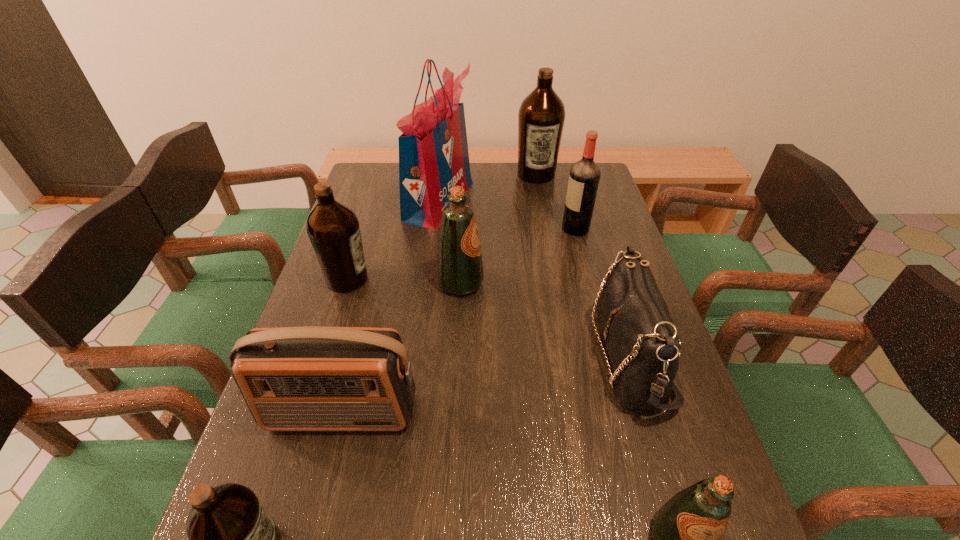
Find the location of a particular element. the tallest object is located at coordinates (433, 151).

The height and width of the screenshot is (540, 960). Identify the location of red grocery bag. (433, 151).

The image size is (960, 540). I want to click on the second olive oil from right to left, so click(541, 116).

Identify the location of the farthest olive oil. The image size is (960, 540). (541, 116).

Where is `liquor`? liquor is located at coordinates (584, 177).

Where is `the third olive oil from right to left`? This screenshot has height=540, width=960. the third olive oil from right to left is located at coordinates (460, 269).

What are the coordinates of `the farther green olive oil` in the screenshot? It's located at (460, 269).

Where is `the second smallest brown olive oil`? the second smallest brown olive oil is located at coordinates (333, 228).

Image resolution: width=960 pixels, height=540 pixels. I want to click on radio receiver, so click(311, 378).

Where is `handbag`? The height and width of the screenshot is (540, 960). handbag is located at coordinates (642, 341).